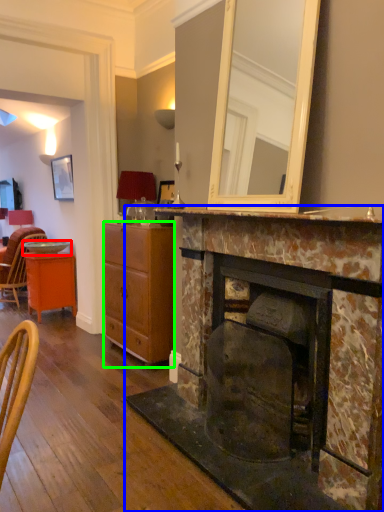
Question: Which object is positioned closest to plate (highlighted by a red box)? Select from fireplace (highlighted by a blue box) and cabinetry (highlighted by a green box).

Choices:
 (A) fireplace
 (B) cabinetry

Answer: (B)